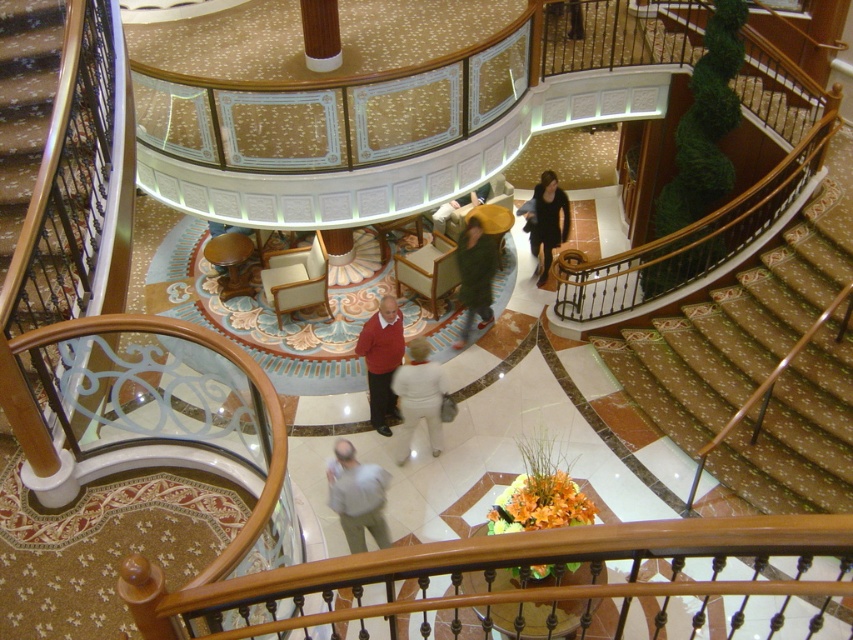
Question: Is white fabric pants at center behind matte red sweater at center?

Choices:
 (A) no
 (B) yes

Answer: (B)

Question: Which of these objects is positioned closest to the white fabric pants at center?

Choices:
 (A) wooden stairwell at left
 (B) wooden at center
 (C) matte red sweater at center
 (D) light gray fabric shirt at center

Answer: (C)

Question: Based on their relative distances, which object is nearer to the wooden stairwell at left?

Choices:
 (A) white fabric pants at center
 (B) matte red sweater at center

Answer: (B)

Question: Does matte red sweater at center appear on the right side of black fabric dress at center?

Choices:
 (A) yes
 (B) no

Answer: (B)

Question: Is light gray fabric shirt at center bigger than matte red sweater at center?

Choices:
 (A) no
 (B) yes

Answer: (A)

Question: Among these objects, which one is farthest from the camera?

Choices:
 (A) light gray fabric shirt at center
 (B) matte red sweater at center
 (C) black fabric dress at center

Answer: (C)